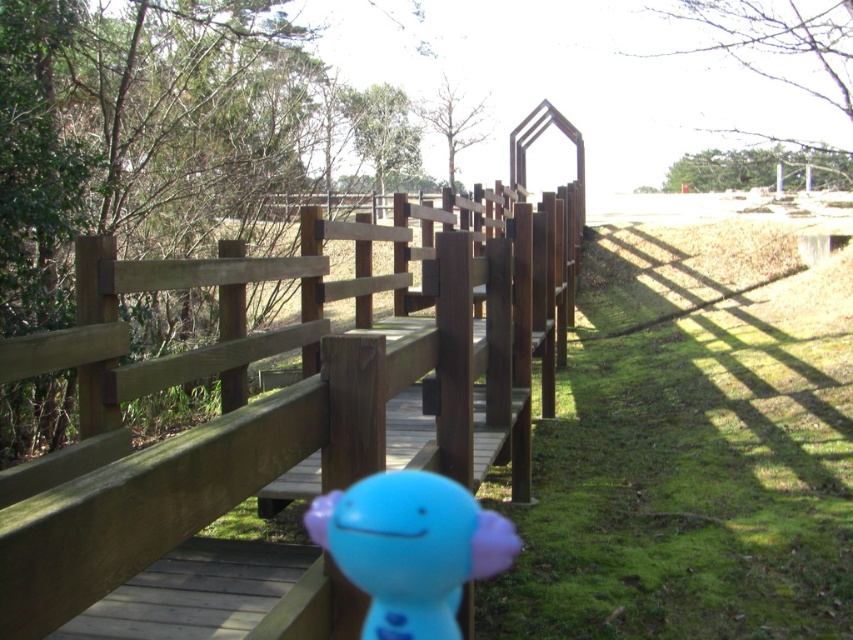
You are standing on the wooden bridge at center and see the blue rubber toy at center in the distance. Which object is closer to you?

The wooden bridge at center is closer to the viewer than the blue rubber toy at center.